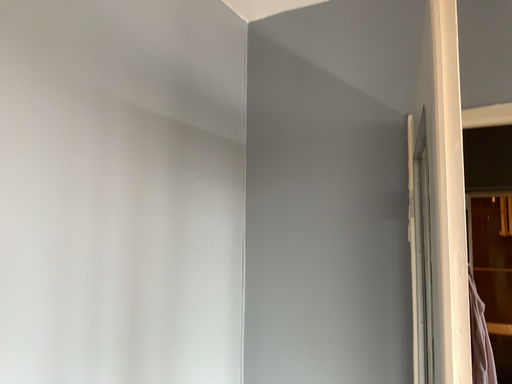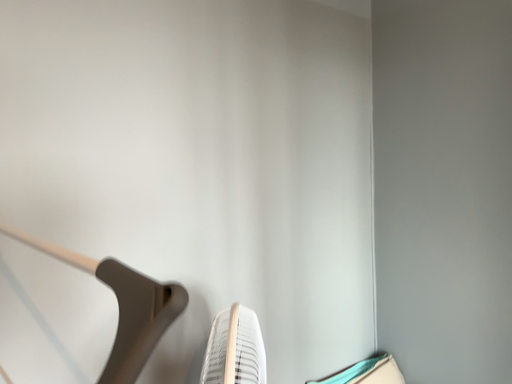
Question: How did the camera likely rotate when shooting the video?

Choices:
 (A) rotated left
 (B) rotated right

Answer: (A)